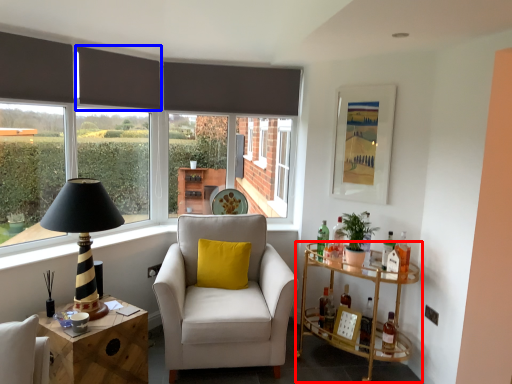
Question: Which object is closer to the camera taking this photo, table (highlighted by a red box) or curtain (highlighted by a blue box)?

Choices:
 (A) table
 (B) curtain

Answer: (A)